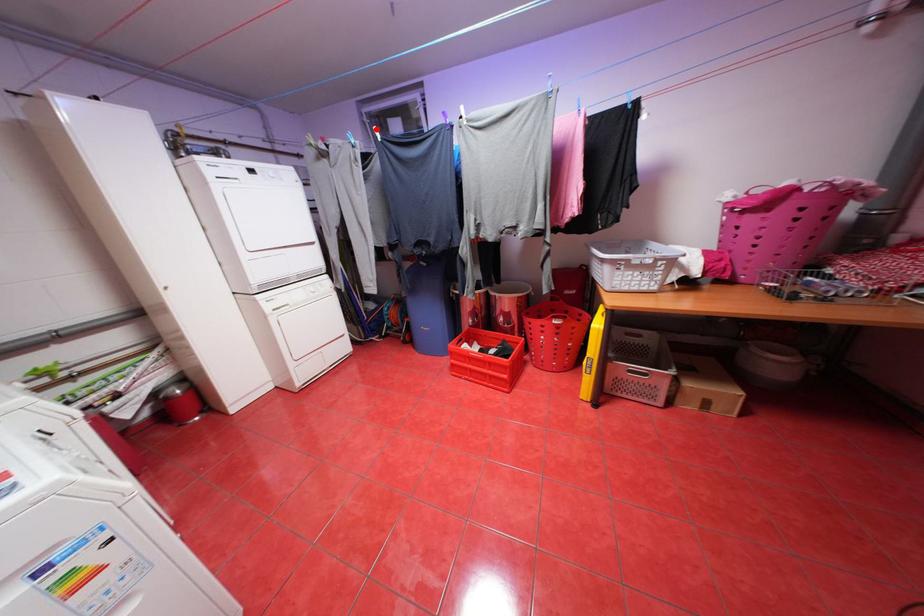
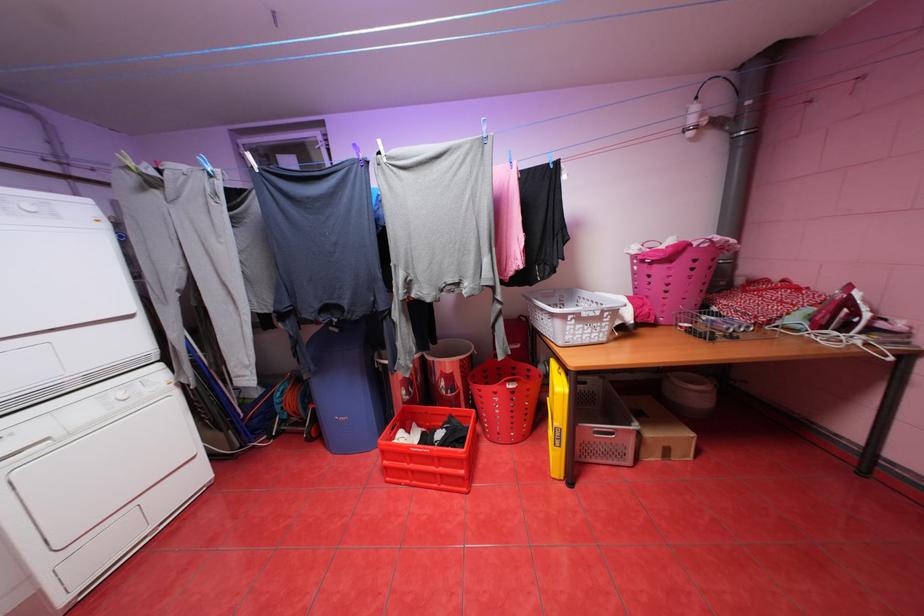
Question: I am providing you with two images of the same scene from different viewpoints. A red point is marked on the first image. Is the red point's position out of view in image 2?

Choices:
 (A) Yes
 (B) No

Answer: (A)